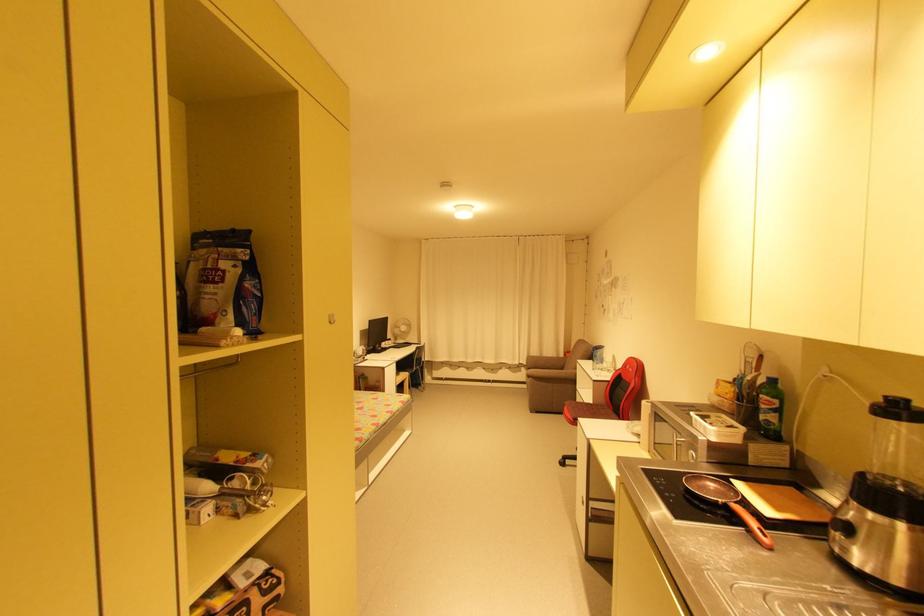
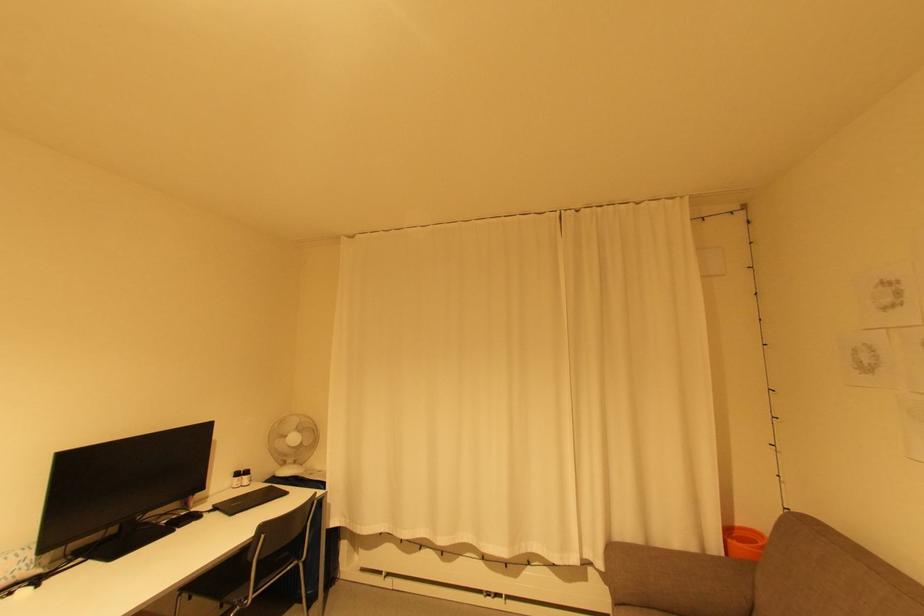
Where in the second image is the point corresponding to (505,369) from the first image?

(533, 564)